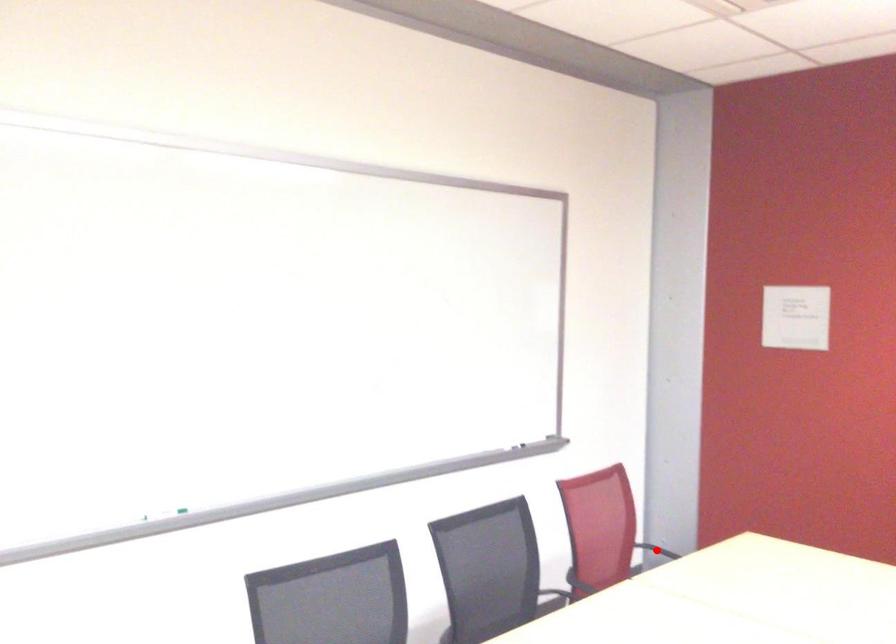
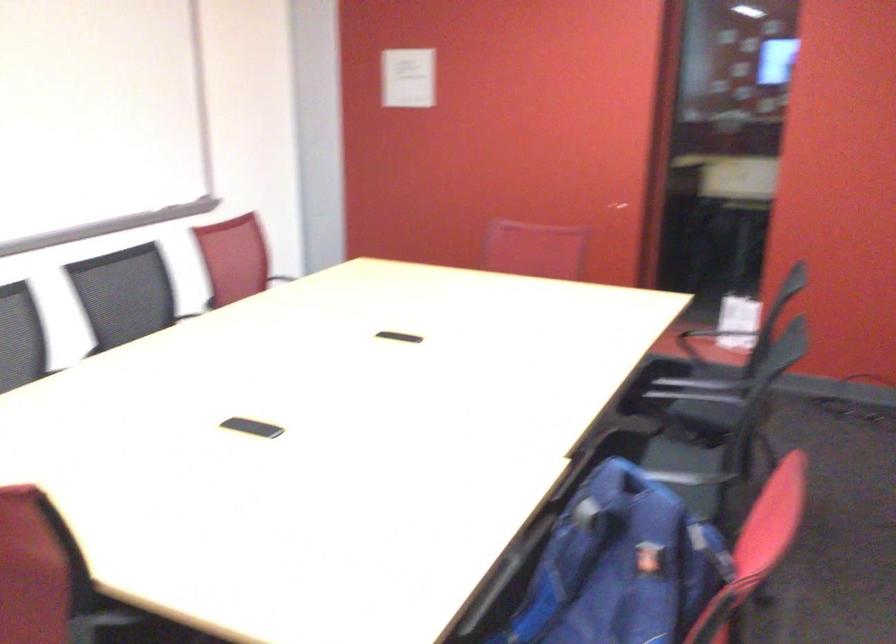
Question: I am providing you with two images of the same scene from different viewpoints. A red point is marked on the first image. Is the red point's position out of view in image 2?

Choices:
 (A) Yes
 (B) No

Answer: (A)